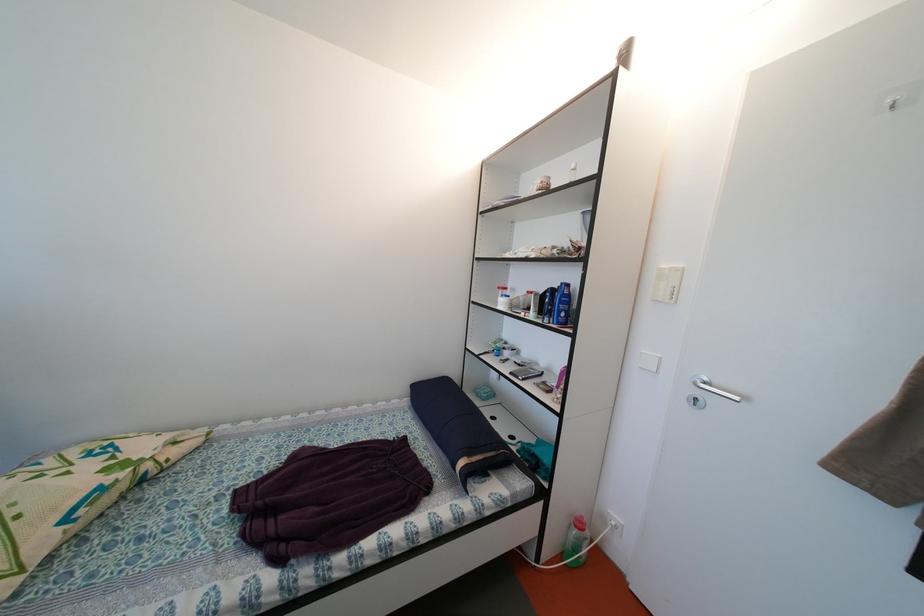
Where would you insert the door keyhole? Please return your answer as a coordinate pair (x, y).

(696, 400)